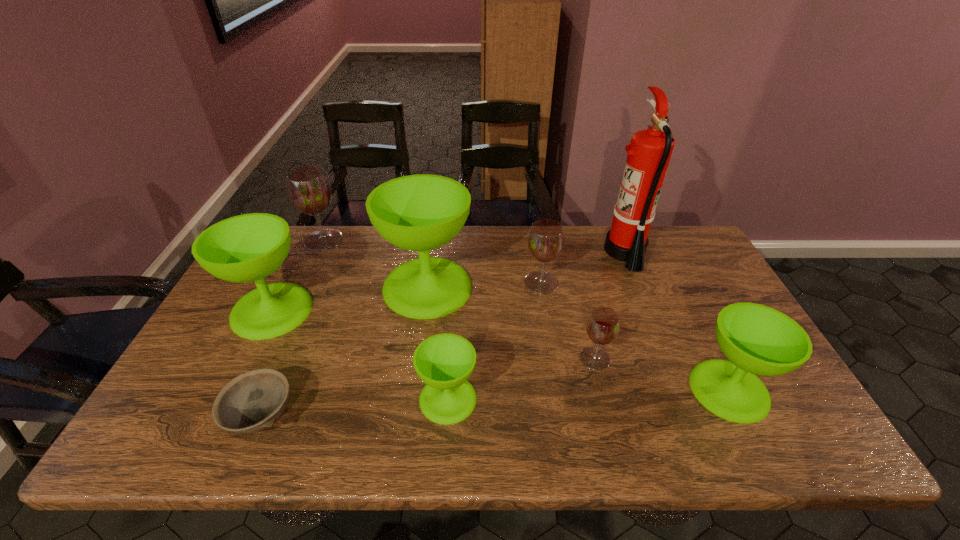
Where is `the fourth object from right to left`? the fourth object from right to left is located at coordinates point(546,239).

You are a GUI agent. You are given a task and a screenshot of the screen. Output one action in this format:
    pyautogui.click(x=<x>, y=<y>)
    Task: Click on the smallest green wineglass
    The width and height of the screenshot is (960, 540).
    Given the screenshot: What is the action you would take?
    pos(444,362)

In order to click on the seventh object from left to right in this screenshot , I will do [x=603, y=325].

Locate an element on the screen. the rightmost red wineglass is located at coordinates (603, 325).

The height and width of the screenshot is (540, 960). In order to click on bowl in this screenshot , I will do `click(253, 401)`.

The height and width of the screenshot is (540, 960). Find the location of `the shortest object`. the shortest object is located at coordinates (253, 401).

This screenshot has width=960, height=540. I want to click on vacant space located 0.300m at the nozzle of the fire extinguisher, so click(515, 252).

This screenshot has height=540, width=960. Find the location of `blank area located at the nozzle of the fire extinguisher`. blank area located at the nozzle of the fire extinguisher is located at coordinates click(x=536, y=252).

Locate an element on the screen. This screenshot has width=960, height=540. free spot located at the nozzle of the fire extinguisher is located at coordinates (500, 252).

The width and height of the screenshot is (960, 540). I want to click on vacant point located on the right of the tallest wineglass, so tap(535, 287).